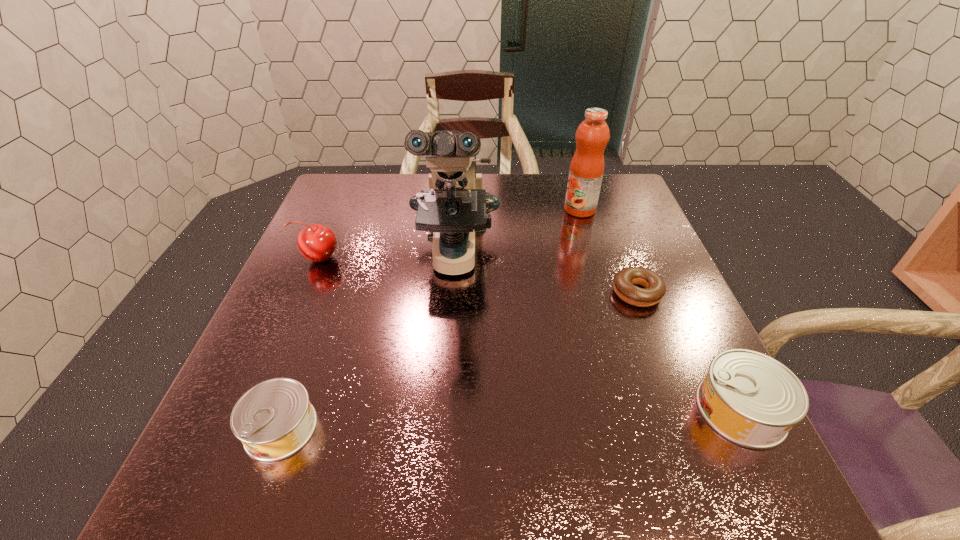
Where is `free space located 0.360m on the left of the taller can`? free space located 0.360m on the left of the taller can is located at coordinates (493, 409).

Locate an element on the screen. The width and height of the screenshot is (960, 540). vacant space located 0.070m on the front label of the fruit juice is located at coordinates tap(540, 210).

Image resolution: width=960 pixels, height=540 pixels. In order to click on free location located on the front label of the fruit juice in this screenshot , I will do `click(468, 210)`.

What are the coordinates of `vacant space situated on the front label of the fruit juice` in the screenshot? It's located at (454, 210).

Locate an element on the screen. vacant position located 0.230m on the right of the cherry is located at coordinates (434, 258).

This screenshot has width=960, height=540. I want to click on free region located on the back of the doughnut, so click(598, 191).

The height and width of the screenshot is (540, 960). What are the coordinates of `free spot located 0.130m through the eyepieces of the fourth object from right to left` in the screenshot? It's located at (448, 355).

At what (x,y) coordinates should I click in order to perform the action: click on fruit juice positioned at the far edge. Please return your answer as a coordinate pair (x, y). The image size is (960, 540). Looking at the image, I should click on (586, 171).

Where is `microscope located at the far edge`? The height and width of the screenshot is (540, 960). microscope located at the far edge is located at coordinates (454, 207).

In order to click on can that is positioned at the left edge in this screenshot , I will do `click(274, 419)`.